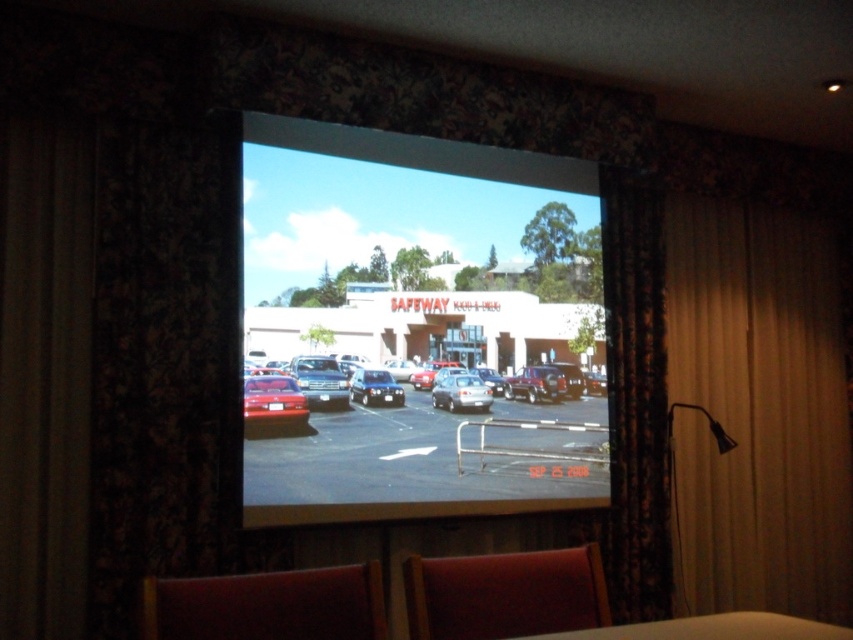
You are a parking attendant trying to locate two vehicles in the Safeway parking lot shown on the screen. The vehicles are the matte red car at center and the shiny blue sedan at center. According to the image, which car is positioned lower in the parking lot?

The matte red car at center is located below the shiny blue sedan at center, so it is positioned lower in the parking lot.

You are sitting in the velvet red chair at center and want to look at the shiny blue sedan at center displayed on the projection screen. Which object is nearer to you when you look straight ahead?

The velvet red chair at center is closer to you than the shiny blue sedan at center, so when you look straight ahead, the velvet red chair at center appears nearer.

You are a parking attendant who needs to fit both the matte red car at center and the shiny blue sedan at center into a parking spot that can only accommodate vehicles up to the size of the shiny blue sedan. Which car should you move to ensure they both fit?

The matte red car at center is larger than the shiny blue sedan at center, so you should move the matte red car at center to make space for both vehicles within the parking spot constraints.